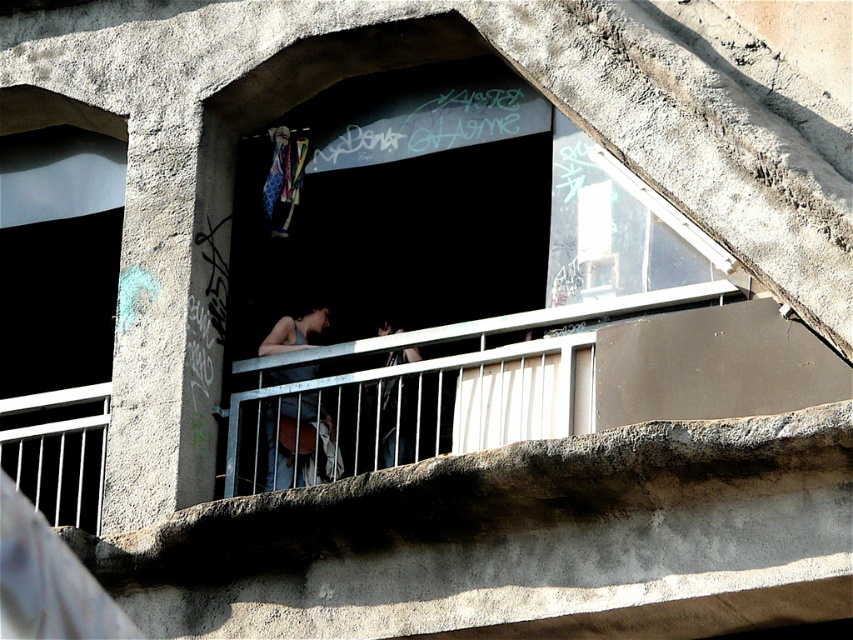
You are standing on the balcony and want to place a small potted plant between the two points, point (x=305, y=320) and point (x=392, y=436). Which point should the plant be closer to in order to be nearer to the viewer?

The plant should be closer to point (x=305, y=320) because it is further to the viewer than point (x=392, y=436).

You are a drone operator trying to deliver a small package to the balcony. The coordinates provided are for the dark blue denim jeans at center. Can you confirm if the jeans are positioned near the railing where the package can be safely placed?

The dark blue denim jeans at center is located at point (280, 444), which suggests it is near the railing where the package can be safely placed.

You are a window cleaner standing on the balcony. You need to clean the transparent glass window at left which is above the dark blue denim jeans at center. Can you safely reach the window without stepping on the jeans?

The transparent glass window at left is positioned over dark blue denim jeans at center, meaning the window is above the jeans. Since the jeans are at the center of the balcony, you can safely reach the window from the sides or edges of the balcony without stepping on the jeans.